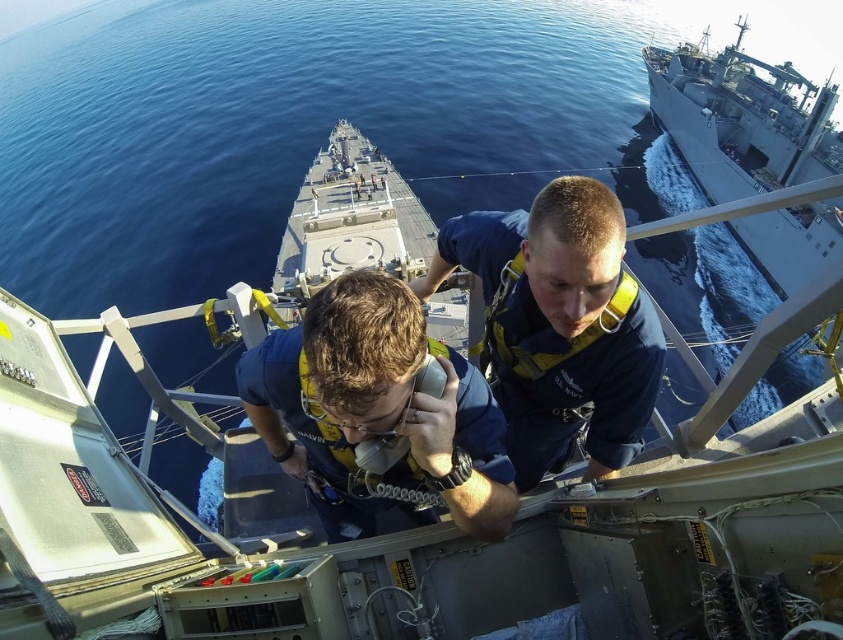
You are a naval officer planning to move a 10 feet long communication cable between the blue fabric sailor at center and the blue fabric uniform at center. Is there enough space between them to place the cable without bending it?

The distance between the blue fabric sailor at center and the blue fabric uniform at center is 15.20 feet, which is greater than the 10 feet length of the cable. Therefore, there is sufficient space to place the cable straight between them without bending it.

You are a ship engineer assessing the deck layout. You need to determine the relative sizes of the blue fabric sailor at center and the gray metallic ship at upper right. Which object is larger?

The gray metallic ship at upper right is larger than the blue fabric sailor at center.

You are a sailor on deck and need to determine which object has a smaller width between the blue fabric uniform at center and the gray metallic ship at upper right. Which one is narrower?

The blue fabric uniform at center is thinner than the gray metallic ship at upper right, so the blue fabric uniform at center is narrower.